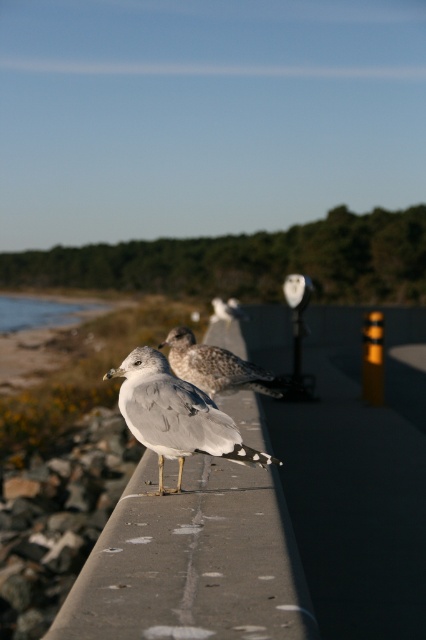
You are a birdwatcher observing two seagulls on a concrete barrier. You notice the gray feathered seagull at center and the speckled feathered seagull at center. Which seagull is positioned lower on the barrier?

The gray feathered seagull at center is located below the speckled feathered seagull at center, so the gray one is lower.

You are a birdwatcher trying to capture both seagulls in a single photo with a camera that has a 2.0 meter focal length. The gray feathered seagull at center and the speckled feathered seagull at center are your subjects. Can your camera frame both birds in the shot without moving closer?

The gray feathered seagull at center and the speckled feathered seagull at center are 1.99 meters apart. Since the camera has a 2.0 meter focal length, which is slightly longer than the distance between the birds, both can be captured in a single frame without needing to move closer.

You are a birdwatcher trying to identify two seagulls on a concrete barrier. The gray feathered seagull at center and the speckled feathered seagull at center are both facing left. Which of the two seagulls has a narrower body?

The gray feathered seagull at center has a narrower body than the speckled feathered seagull at center.